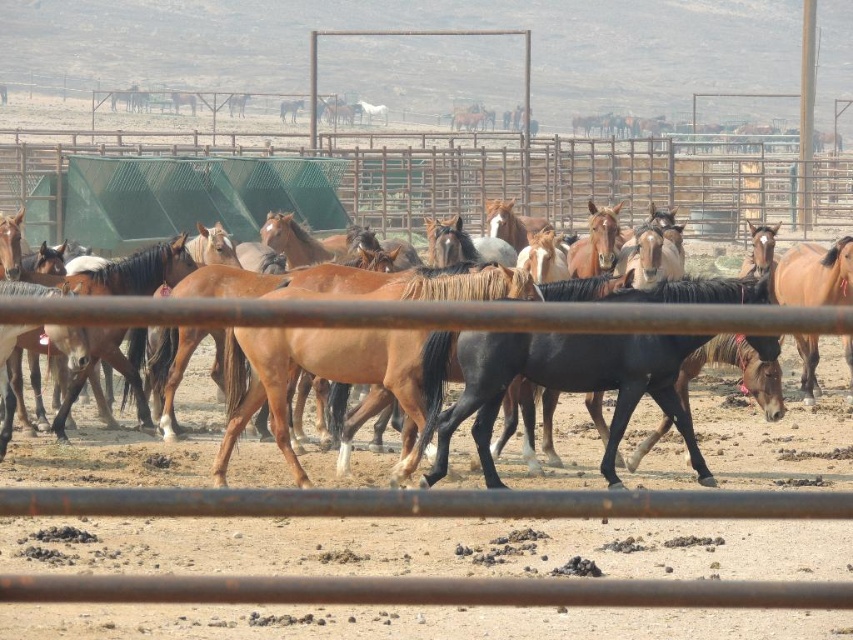
Question: Is green wire mesh fence at upper center above brown glossy horse at center?

Choices:
 (A) yes
 (B) no

Answer: (A)

Question: Where is green wire mesh fence at upper center located in relation to brown glossy horse at center in the image?

Choices:
 (A) right
 (B) left

Answer: (A)

Question: Is green wire mesh fence at upper center in front of brown glossy horse at center?

Choices:
 (A) yes
 (B) no

Answer: (B)

Question: Which object is farther from the camera taking this photo?

Choices:
 (A) green wire mesh fence at upper center
 (B) brown glossy horse at center

Answer: (A)

Question: Which of the following is the farthest from the observer?

Choices:
 (A) green wire mesh fence at upper center
 (B) brown glossy horse at center

Answer: (A)

Question: Among these objects, which one is nearest to the camera?

Choices:
 (A) green wire mesh fence at upper center
 (B) brown glossy horse at center

Answer: (B)